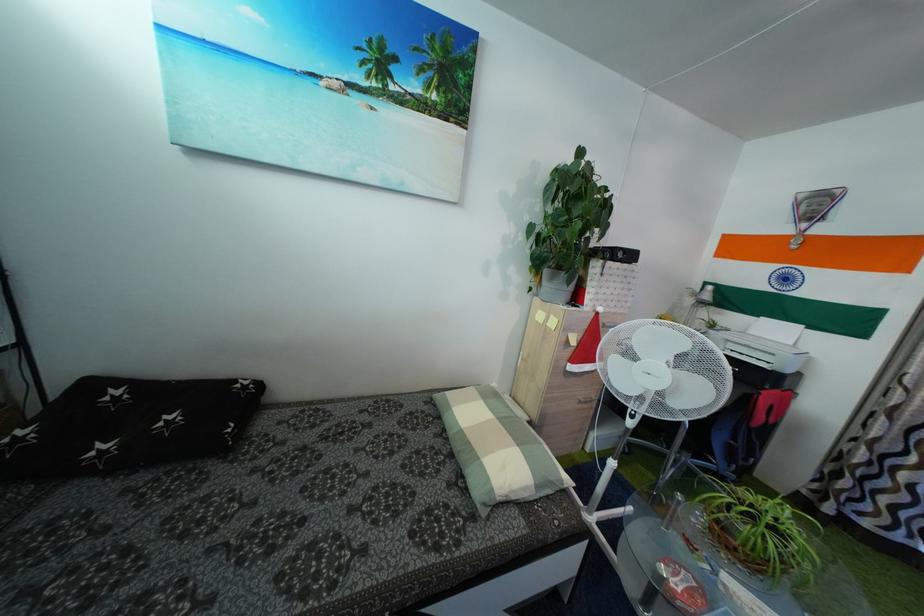
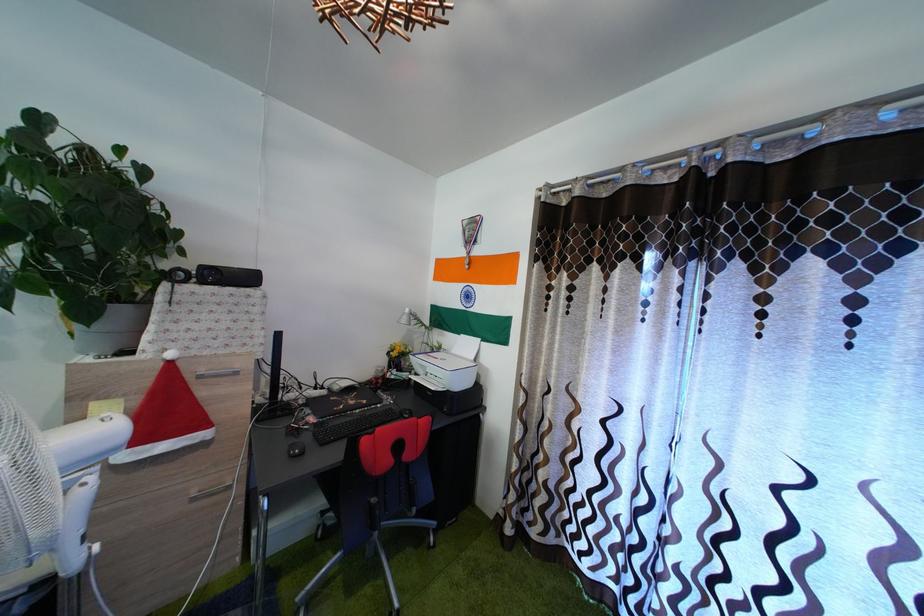
In the second image, find the point that corresponds to the point at 638,264 in the first image.

(257, 286)